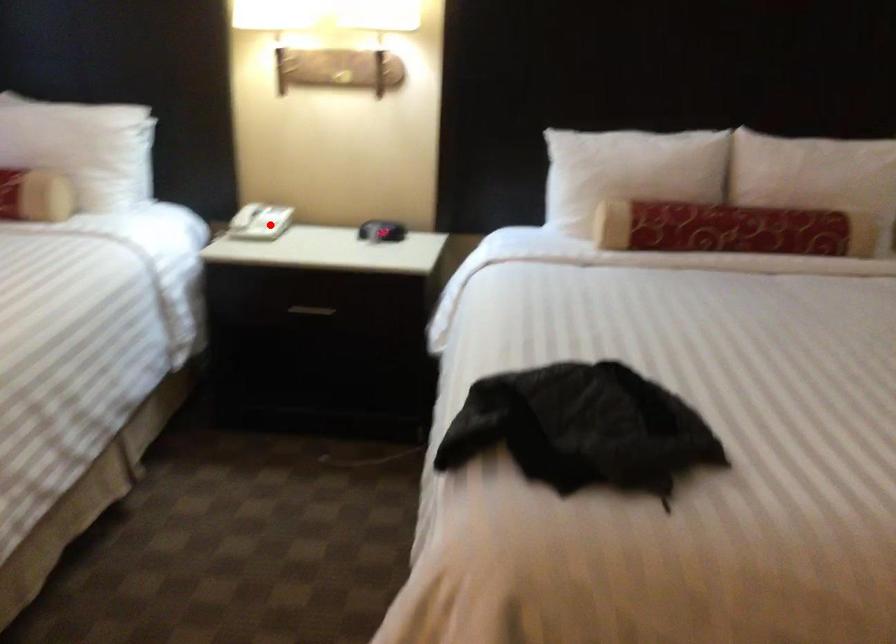
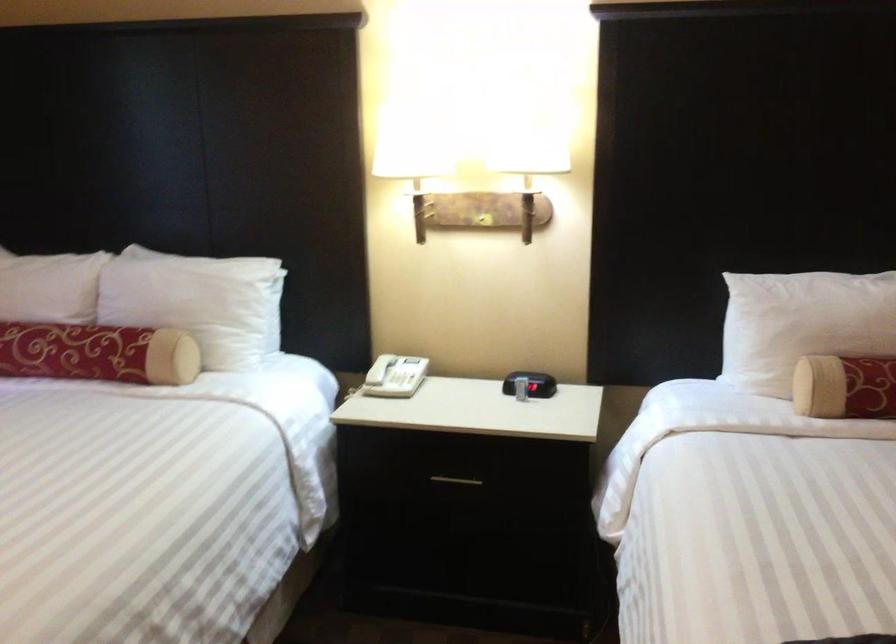
In the second image, find the point that corresponds to the highlighted location in the first image.

(405, 380)